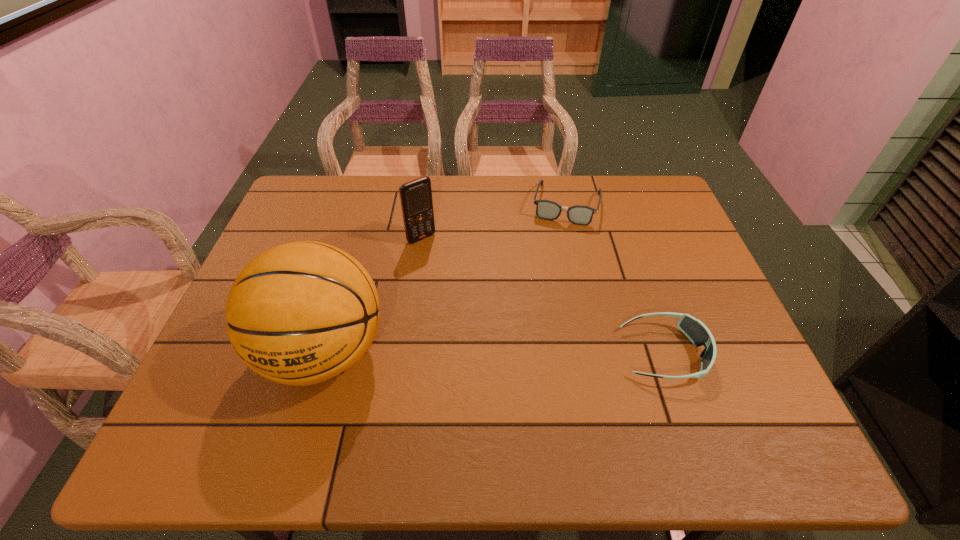
The image size is (960, 540). Identify the location of vacant space at the near edge of the desktop. (372, 379).

At what (x,y) coordinates should I click in order to perform the action: click on vacant space at the right edge of the desktop. Please return your answer as a coordinate pair (x, y). Looking at the image, I should click on (667, 240).

In the image, there is a desktop. What are the coordinates of `vacant space at the near right corner` in the screenshot? It's located at (x=750, y=382).

In order to click on vacant area between the goggles and the farthest object in this screenshot , I will do `click(615, 279)`.

Where is `vacant area that lies between the spectacles and the second farthest object`? The width and height of the screenshot is (960, 540). vacant area that lies between the spectacles and the second farthest object is located at coordinates (494, 221).

You are a GUI agent. You are given a task and a screenshot of the screen. Output one action in this format:
    pyautogui.click(x=<x>, y=<y>)
    Task: Click on the vacant space that is in between the spectacles and the basketball
    The height and width of the screenshot is (540, 960).
    Given the screenshot: What is the action you would take?
    pyautogui.click(x=445, y=279)

In order to click on free space between the farthest object and the goggles in this screenshot , I will do `click(615, 279)`.

The height and width of the screenshot is (540, 960). Identify the location of free space that is in between the goggles and the basketball. (494, 353).

Identify the location of blank region between the spectacles and the tallest object. (445, 279).

Find the location of `vacant area that lies between the tallest object and the goggles`. vacant area that lies between the tallest object and the goggles is located at coordinates (494, 353).